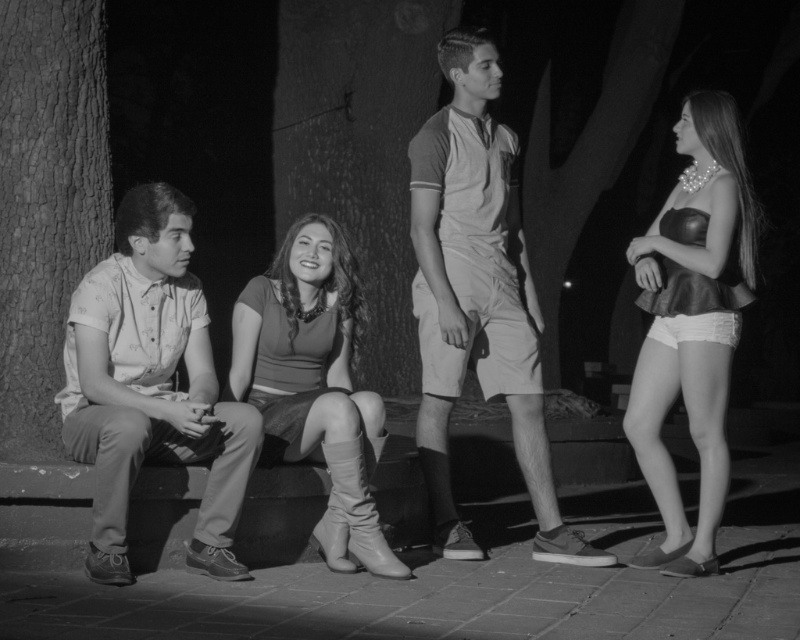
Question: Which of the following is the farthest from the observer?

Choices:
 (A) (297, 102)
 (B) (300, 307)
 (C) (0, 356)
 (D) (80, 406)

Answer: (A)

Question: Can you confirm if rough bark tree at center is positioned to the right of leather skirt at right?

Choices:
 (A) no
 (B) yes

Answer: (A)

Question: Which object is positioned farthest from the light beige shorts at center?

Choices:
 (A) smooth bark tree at left
 (B) light beige cotton shirt at left

Answer: (A)

Question: Does smooth bark tree at left have a lesser width compared to leather skirt at right?

Choices:
 (A) no
 (B) yes

Answer: (B)

Question: Which object is farther from the camera taking this photo?

Choices:
 (A) smooth bark tree at left
 (B) matte gray boots at center

Answer: (A)

Question: Does light beige cotton shirt at left appear over smooth bark tree at left?

Choices:
 (A) yes
 (B) no

Answer: (B)